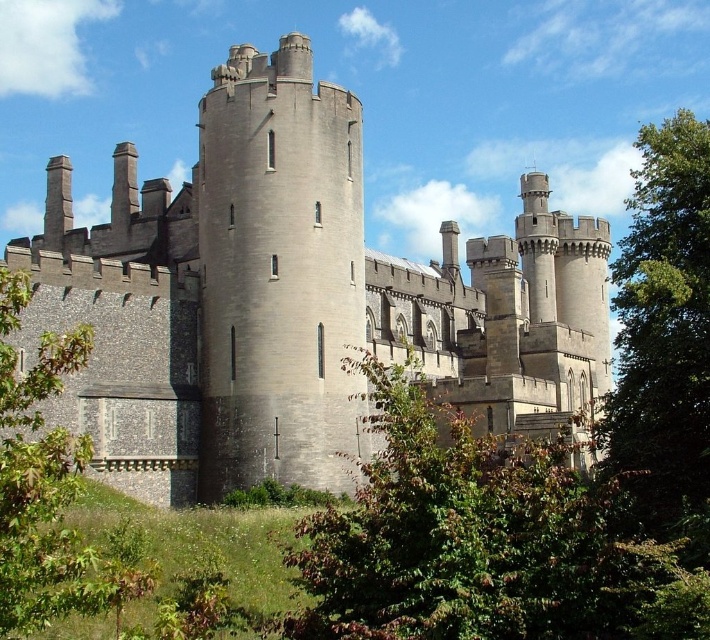
Question: Does green leafy bush at center have a greater width compared to green leafy tree at lower left?

Choices:
 (A) yes
 (B) no

Answer: (A)

Question: Does gray stone castle at center appear on the left side of green leafy tree at lower left?

Choices:
 (A) no
 (B) yes

Answer: (A)

Question: Which of the following is the closest to the observer?

Choices:
 (A) green leafy bush at center
 (B) gray stone castle at center
 (C) gray stone tower at center

Answer: (A)

Question: Is green leafy bush at center bigger than green leafy tree at right?

Choices:
 (A) no
 (B) yes

Answer: (A)

Question: Among these points, which one is nearest to the camera?

Choices:
 (A) (670, 195)
 (B) (262, 467)
 (C) (329, 602)

Answer: (C)

Question: Which of the following is the closest to the observer?

Choices:
 (A) (45, 268)
 (B) (453, 417)
 (C) (49, 528)

Answer: (C)